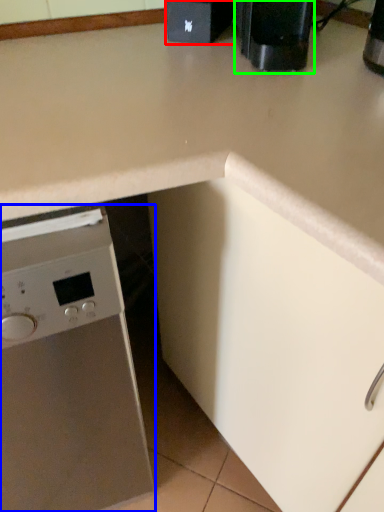
Question: Which object is positioned farthest from appliance (highlighted by a red box)? Select from home appliance (highlighted by a blue box) and coffee machine (highlighted by a green box).

Choices:
 (A) home appliance
 (B) coffee machine

Answer: (A)